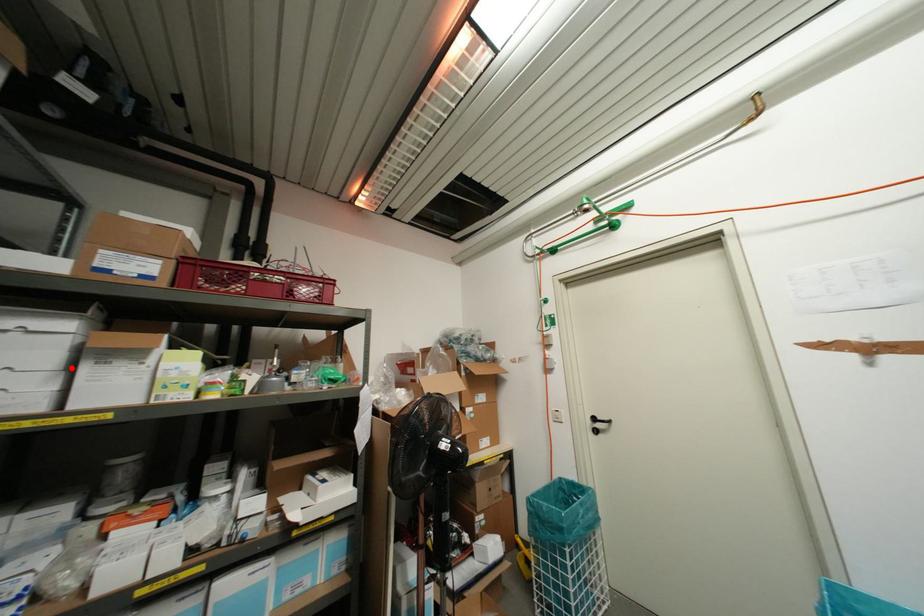
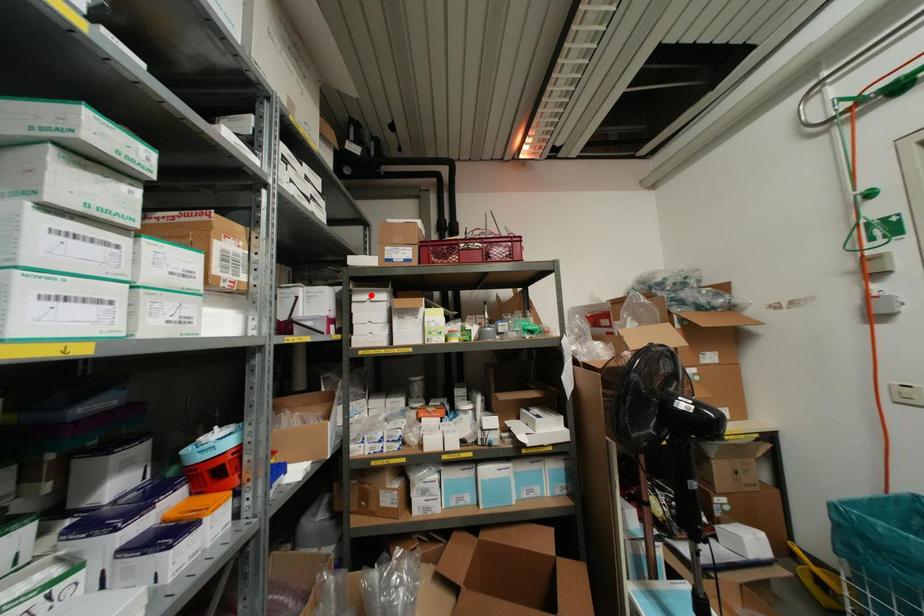
I am providing you with two images of the same scene from different viewpoints. A red point is marked on the first image and another point is marked on the second image. Does the point marked in image1 correspond to the same location as the one in image2?

No